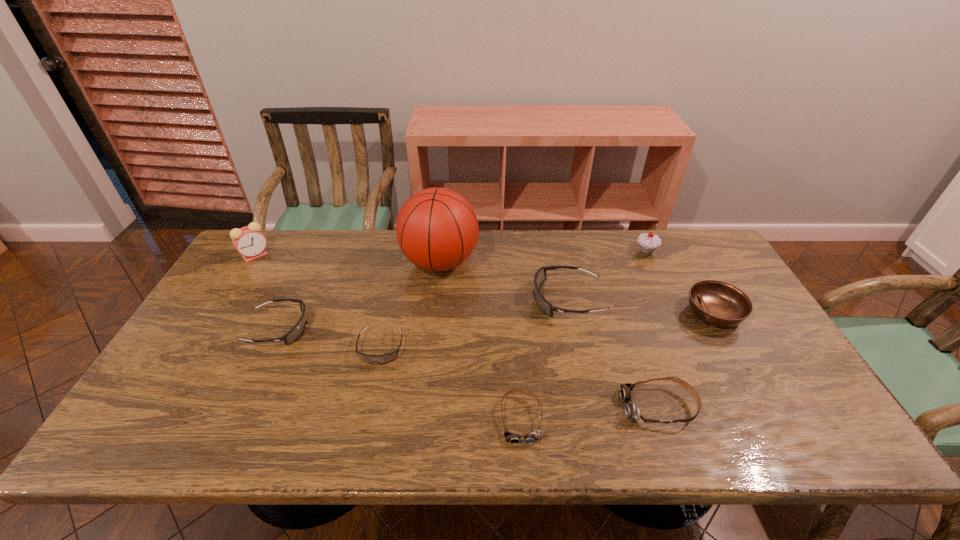
Identify the location of the tallest object. (437, 229).

This screenshot has width=960, height=540. I want to click on gray cupcake, so click(648, 242).

Locate an element on the screen. The height and width of the screenshot is (540, 960). the leftmost object is located at coordinates (249, 241).

I want to click on pink alarm clock, so [x=249, y=241].

Where is `the rightmost black goggles`? The height and width of the screenshot is (540, 960). the rightmost black goggles is located at coordinates (540, 277).

The height and width of the screenshot is (540, 960). Find the location of `the biggest black goggles`. the biggest black goggles is located at coordinates (540, 277).

I want to click on soup bowl, so click(x=718, y=303).

I want to click on the leftmost goggles, so click(295, 333).

You are a GUI agent. You are given a task and a screenshot of the screen. Output one action in this format:
    pyautogui.click(x=<x>, y=<y>)
    Task: Click on the eighth object from right to left
    Image resolution: width=960 pixels, height=540 pixels.
    Given the screenshot: What is the action you would take?
    pyautogui.click(x=295, y=333)

The width and height of the screenshot is (960, 540). In order to click on the right brown goggles in this screenshot , I will do `click(632, 412)`.